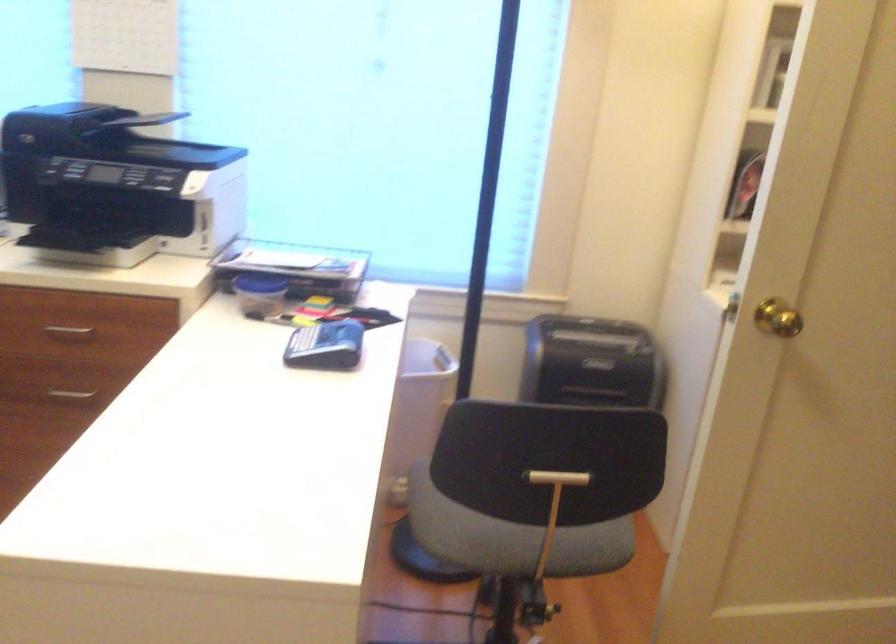
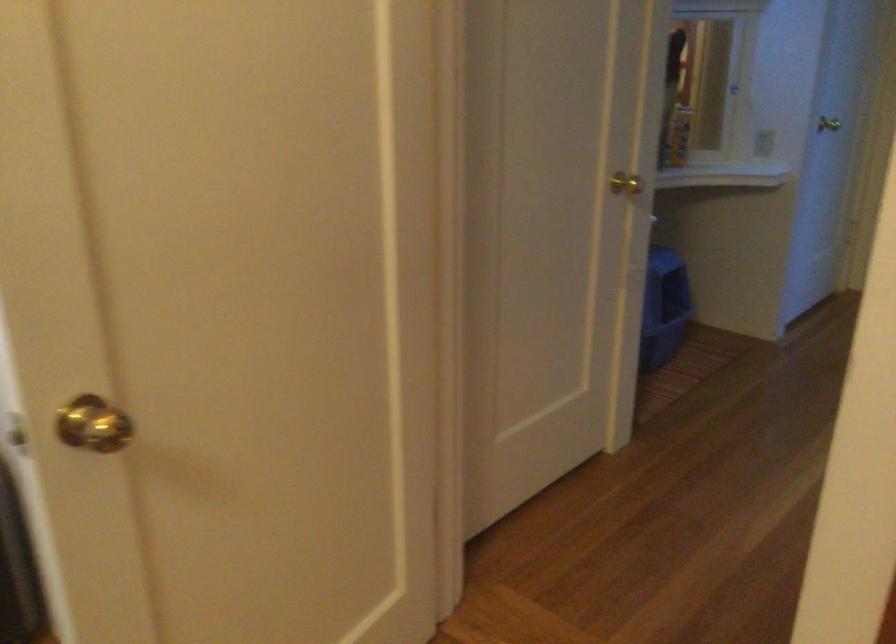
Question: The images are taken continuously from a first-person perspective. In which direction is your viewpoint rotating?

Choices:
 (A) Left
 (B) Right
 (C) Up
 (D) Down

Answer: (B)